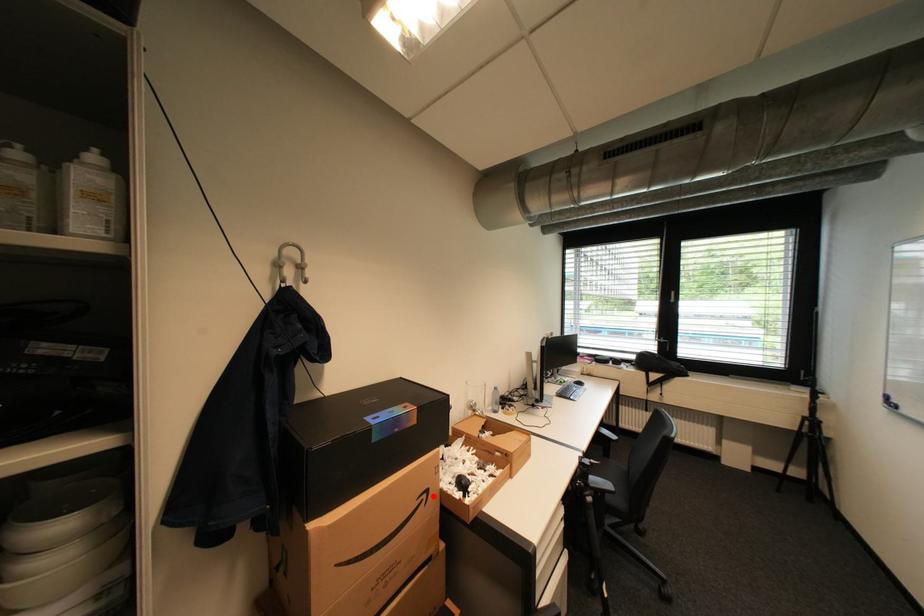
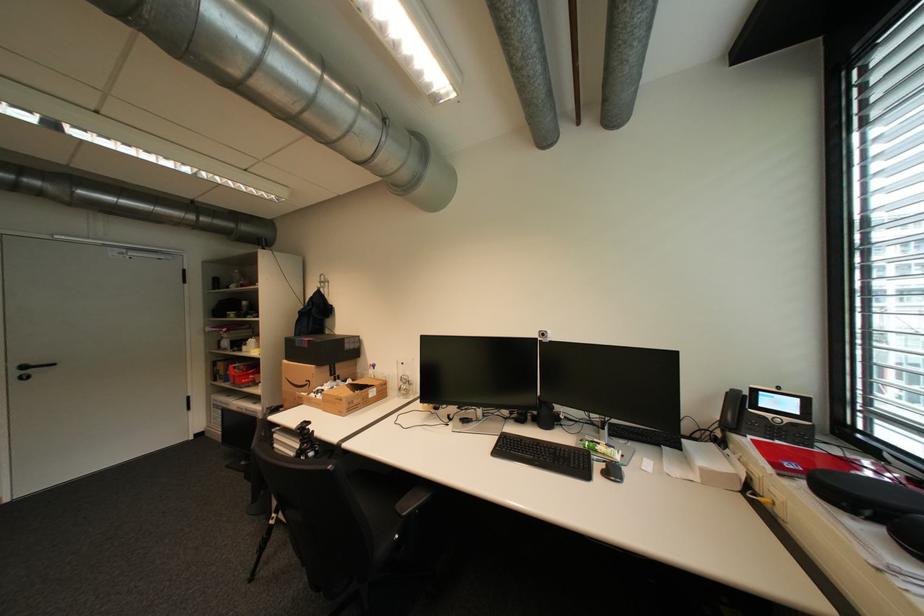
Where in the second image is the point corresponding to the highlighted location from the first image?

(317, 383)